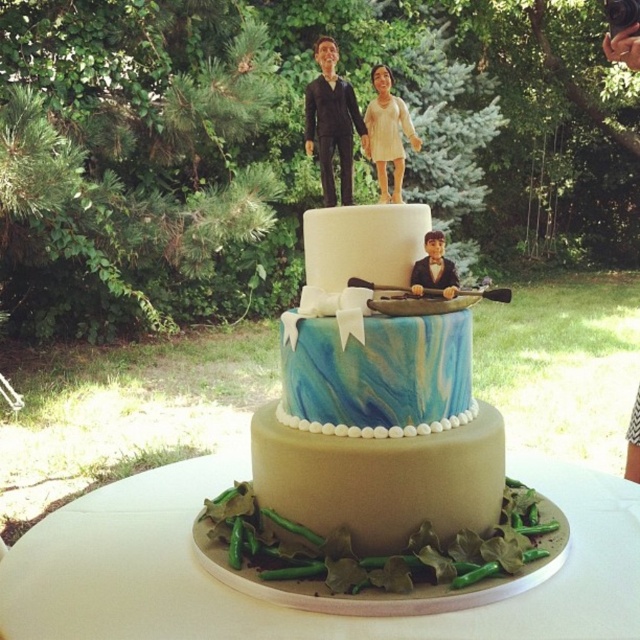
Question: Which point is closer to the camera?

Choices:
 (A) smooth beige figurine at upper center
 (B) matte black suit at center
 (C) smooth matte figurines at upper center

Answer: (B)

Question: Considering the relative positions of marble blue cake at center and beige fondant cake at center in the image provided, where is marble blue cake at center located with respect to beige fondant cake at center?

Choices:
 (A) right
 (B) left

Answer: (A)

Question: Is marble blue cake at center smaller than beige fondant cake at center?

Choices:
 (A) no
 (B) yes

Answer: (A)

Question: Estimate the real-world distances between objects in this image. Which object is closer to the smooth matte figurines at upper center?

Choices:
 (A) smooth beige figurine at upper center
 (B) matte black suit at center
 (C) beige fondant cake at center
 (D) marble blue cake at center

Answer: (A)

Question: Which is farther from the smooth matte figurines at upper center?

Choices:
 (A) smooth beige figurine at upper center
 (B) marble blue cake at center

Answer: (B)

Question: Does smooth matte figurines at upper center appear on the right side of matte black suit at center?

Choices:
 (A) yes
 (B) no

Answer: (B)